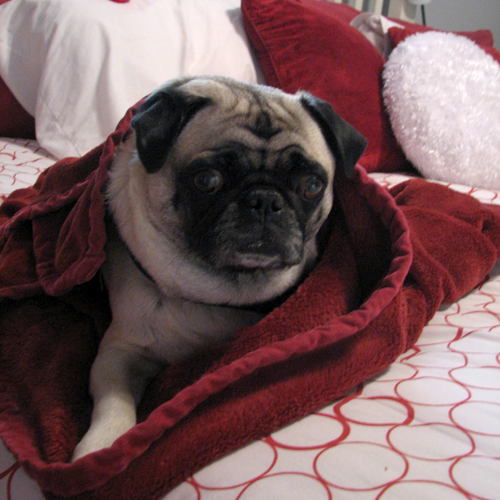
Where is `bedsheet`? The width and height of the screenshot is (500, 500). bedsheet is located at coordinates (384, 449).